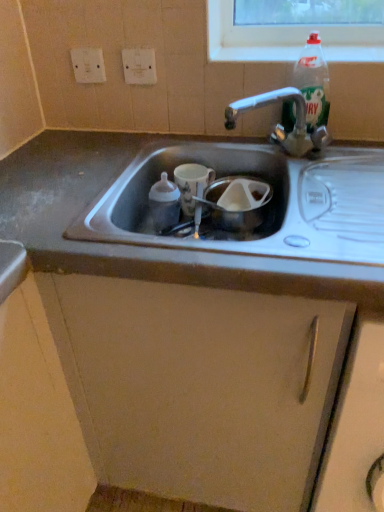
You are a GUI agent. You are given a task and a screenshot of the screen. Output one action in this format:
    pyautogui.click(x=<x>, y=<y>)
    Task: Click on the free space to the left of clear plastic bottle at upper right, marked as the 2th bottle in a left-to-right arrangement
    The height and width of the screenshot is (512, 384).
    Given the screenshot: What is the action you would take?
    pyautogui.click(x=245, y=140)